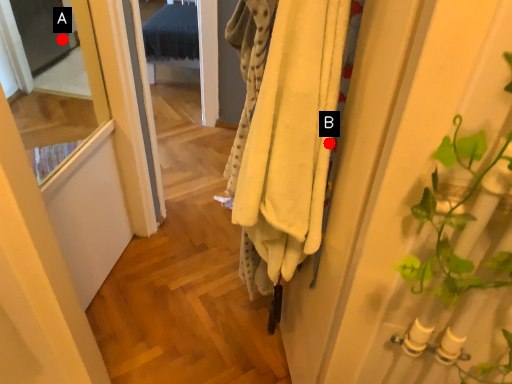
Question: Two points are circled on the image, labeled by A and B beside each circle. Which point appears closest to the camera in this image?

Choices:
 (A) A is closer
 (B) B is closer

Answer: (B)